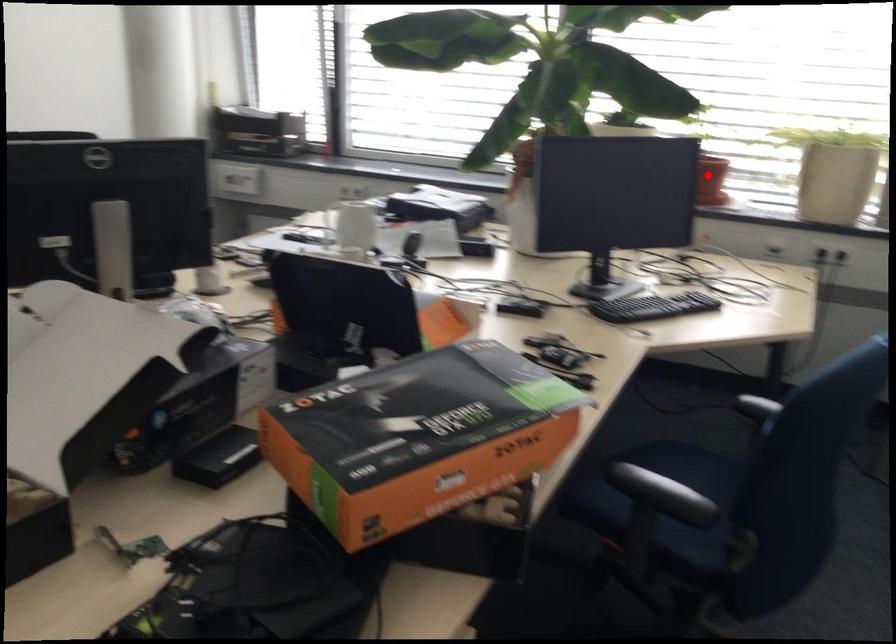
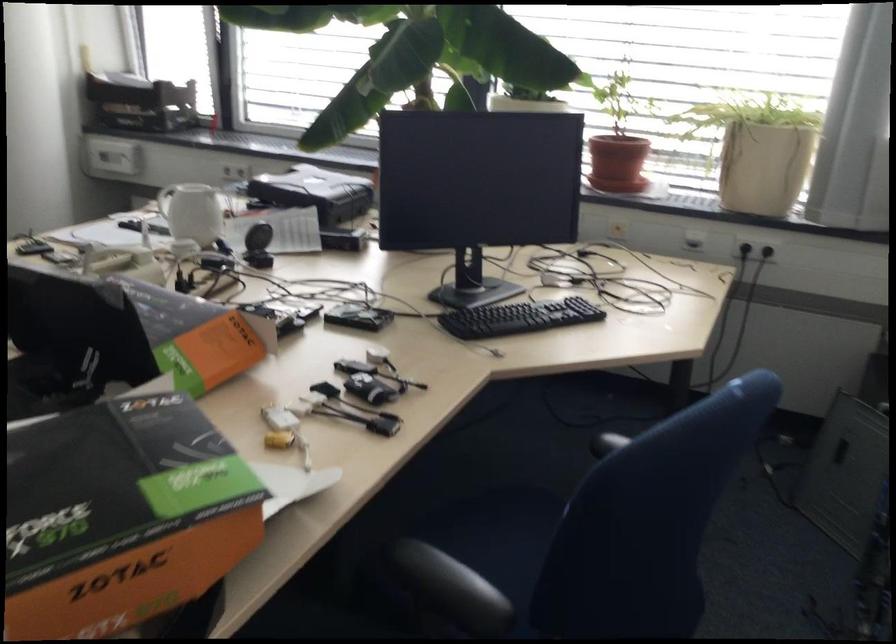
Find the pixel in the second image that matches the highlighted location in the first image.

(616, 163)